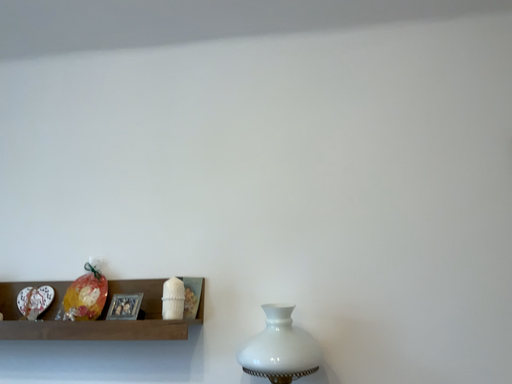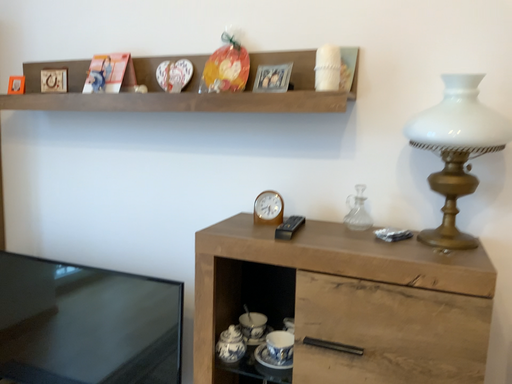
Question: Which way did the camera rotate in the video?

Choices:
 (A) rotated left
 (B) rotated right

Answer: (A)